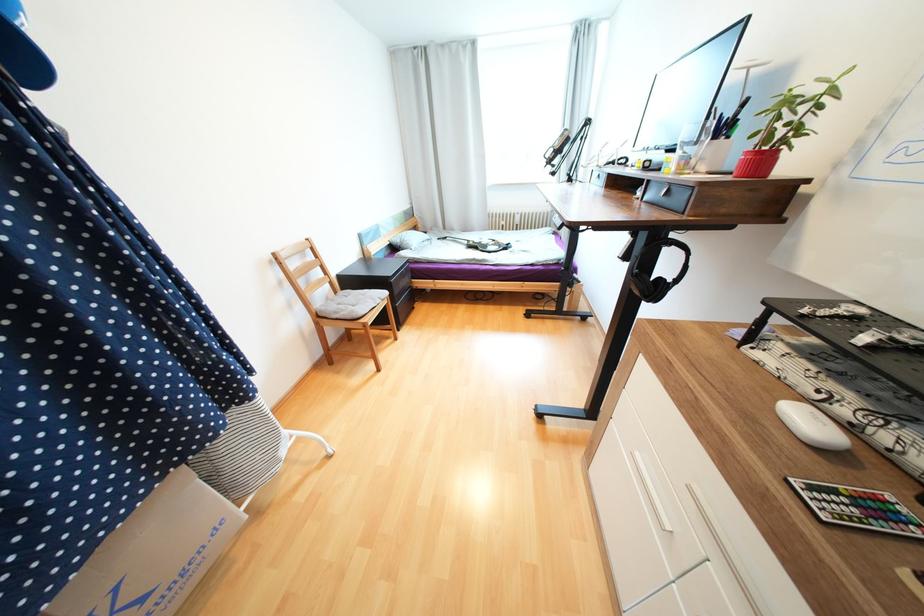
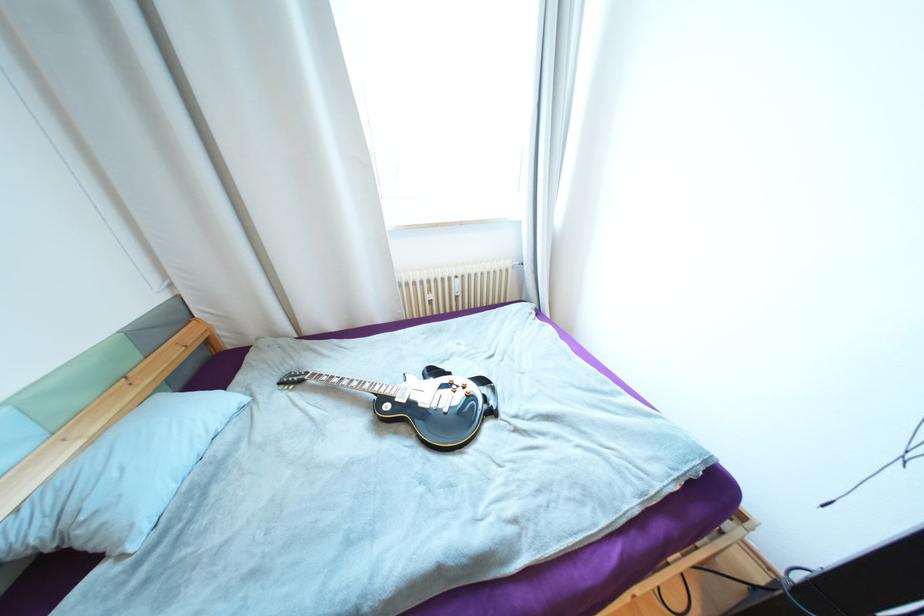
Find the pixel in the second image that matches point (512, 249) in the first image.

(497, 413)